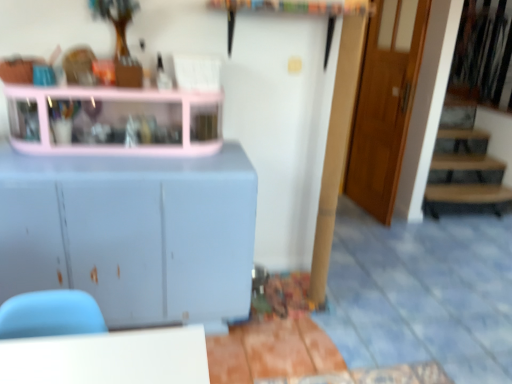
Question: From the image's perspective, is wooden door at right over pink plastic shelf at upper left?

Choices:
 (A) yes
 (B) no

Answer: (A)

Question: From the image's perspective, would you say wooden door at right is shown under pink plastic shelf at upper left?

Choices:
 (A) no
 (B) yes

Answer: (A)

Question: Does wooden door at right have a greater width compared to pink plastic shelf at upper left?

Choices:
 (A) yes
 (B) no

Answer: (B)

Question: Can you confirm if wooden door at right is thinner than pink plastic shelf at upper left?

Choices:
 (A) yes
 (B) no

Answer: (A)

Question: Is wooden door at right positioned far away from pink plastic shelf at upper left?

Choices:
 (A) no
 (B) yes

Answer: (B)

Question: In terms of height, does wooden door at right look taller or shorter compared to pink plastic shelf at upper left?

Choices:
 (A) short
 (B) tall

Answer: (B)

Question: Considering their positions, is wooden door at right located in front of or behind pink plastic shelf at upper left?

Choices:
 (A) behind
 (B) front

Answer: (A)

Question: Is wooden door at right bigger or smaller than pink plastic shelf at upper left?

Choices:
 (A) small
 (B) big

Answer: (B)

Question: Visually, is wooden door at right positioned to the left or to the right of pink plastic shelf at upper left?

Choices:
 (A) left
 (B) right

Answer: (B)

Question: Visually, is pink plastic shelf at upper left positioned to the left or to the right of wooden door at right?

Choices:
 (A) left
 (B) right

Answer: (A)

Question: Considering the positions of point (123, 112) and point (407, 49), is point (123, 112) closer or farther from the camera than point (407, 49)?

Choices:
 (A) closer
 (B) farther

Answer: (A)

Question: Considering the positions of pink plastic shelf at upper left and wooden door at right in the image, is pink plastic shelf at upper left bigger or smaller than wooden door at right?

Choices:
 (A) small
 (B) big

Answer: (A)

Question: In terms of height, does pink plastic shelf at upper left look taller or shorter compared to wooden door at right?

Choices:
 (A) tall
 (B) short

Answer: (B)

Question: From the image's perspective, relative to matte white cabinet at left, is wooden door at right above or below?

Choices:
 (A) above
 (B) below

Answer: (A)

Question: Is wooden door at right situated inside matte white cabinet at left or outside?

Choices:
 (A) inside
 (B) outside

Answer: (B)